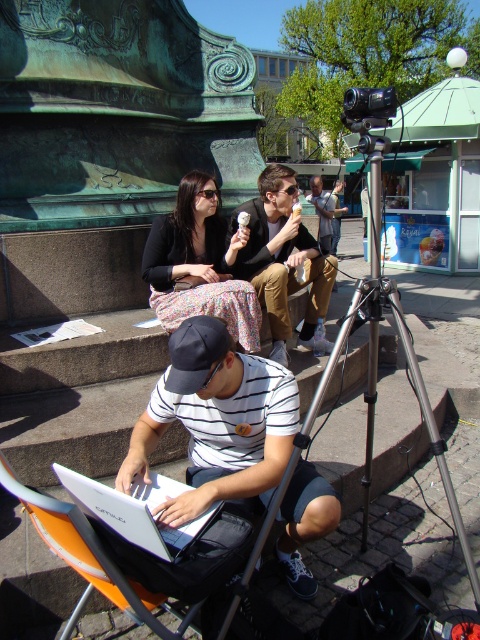
Question: Is silver metallic tripod at center bigger than matte brown jacket at center?

Choices:
 (A) yes
 (B) no

Answer: (A)

Question: Which object appears closest to the camera in this image?

Choices:
 (A) smooth brown leather jacket at center
 (B) matte brown jacket at center

Answer: (B)

Question: Does floral skirt at center come in front of silver metallic tripod at center?

Choices:
 (A) yes
 (B) no

Answer: (B)

Question: Which point appears closest to the camera in this image?

Choices:
 (A) (283, 326)
 (B) (2, 474)
 (C) (164, 496)

Answer: (B)

Question: Observing the image, what is the correct spatial positioning of matte brown jacket at center in reference to smooth brown leather jacket at center?

Choices:
 (A) below
 (B) above

Answer: (A)

Question: Which point is farther to the camera?

Choices:
 (A) white striped shirt at center
 (B) silver metallic tripod at center

Answer: (B)